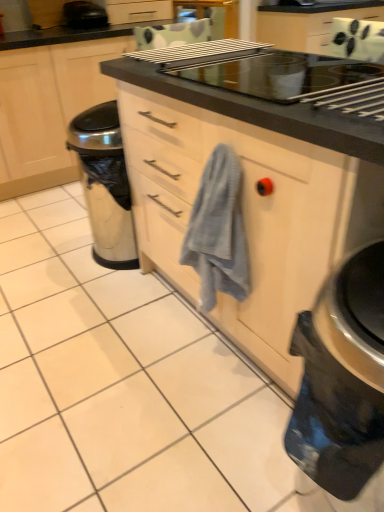
Question: Can you confirm if gray textured towel at center is positioned to the left of black glossy electric kettle at lower right?

Choices:
 (A) yes
 (B) no

Answer: (A)

Question: Are gray textured towel at center and black glossy electric kettle at lower right far apart?

Choices:
 (A) yes
 (B) no

Answer: (B)

Question: Is gray textured towel at center aimed at black glossy electric kettle at lower right?

Choices:
 (A) yes
 (B) no

Answer: (B)

Question: Is gray textured towel at center outside of black glossy electric kettle at lower right?

Choices:
 (A) yes
 (B) no

Answer: (A)

Question: Is gray textured towel at center thinner than black glossy electric kettle at lower right?

Choices:
 (A) no
 (B) yes

Answer: (B)

Question: From their relative heights in the image, would you say matte black cabinet at center is taller or shorter than black glossy electric kettle at lower right?

Choices:
 (A) short
 (B) tall

Answer: (B)

Question: From the image's perspective, is matte black cabinet at center located above or below black glossy electric kettle at lower right?

Choices:
 (A) below
 (B) above

Answer: (B)

Question: In terms of width, does matte black cabinet at center look wider or thinner when compared to black glossy electric kettle at lower right?

Choices:
 (A) wide
 (B) thin

Answer: (A)

Question: Relative to black glossy electric kettle at lower right, is matte black cabinet at center in front or behind?

Choices:
 (A) behind
 (B) front

Answer: (A)

Question: Based on their positions, is black glossy electric kettle at lower right located to the left or right of black plastic toaster at upper left?

Choices:
 (A) right
 (B) left

Answer: (A)

Question: Considering the positions of black glossy electric kettle at lower right and black plastic toaster at upper left in the image, is black glossy electric kettle at lower right taller or shorter than black plastic toaster at upper left?

Choices:
 (A) short
 (B) tall

Answer: (B)

Question: Is black glossy electric kettle at lower right situated inside black plastic toaster at upper left or outside?

Choices:
 (A) outside
 (B) inside

Answer: (A)

Question: Relative to black plastic toaster at upper left, is black glossy electric kettle at lower right in front or behind?

Choices:
 (A) front
 (B) behind

Answer: (A)

Question: In terms of size, does gray textured towel at center appear bigger or smaller than black glossy electric kettle at lower right?

Choices:
 (A) small
 (B) big

Answer: (A)

Question: Would you say gray textured towel at center is inside or outside black glossy electric kettle at lower right?

Choices:
 (A) inside
 (B) outside

Answer: (B)